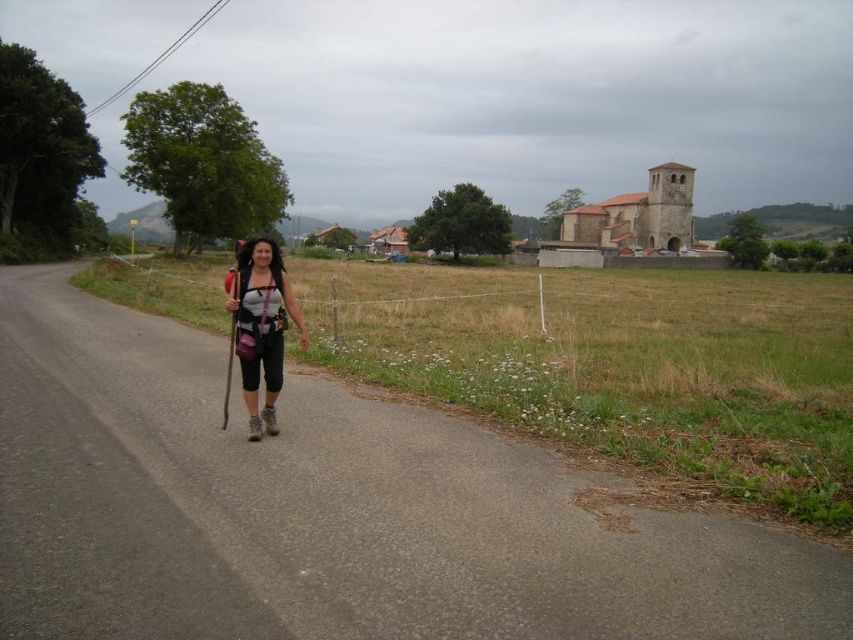
You are a hiker who wants to place your wooden ski pole at center on the ground next to the gray asphalt road at center. According to the scene, where should you place it relative to the road?

The gray asphalt road at center is positioned on the right side of the wooden ski pole at center, so you should place the wooden ski pole at center to the left of the gray asphalt road at center.

You are a hiker who wants to know if the gray asphalt road at center is higher or lower than the matte black backpack at center. Based on the scene, can you determine which one is taller?

The gray asphalt road at center has a lesser height compared to matte black backpack at center, so the matte black backpack at center is taller.

You are a traveler carrying a matte black backpack at center and a wooden ski pole at center. You need to pack both items into a storage compartment that can only hold one item at a time. Which item should you choose to store first if you want to maximize the remaining space for other items?

The matte black backpack at center is smaller than the wooden ski pole at center, so storing the wooden ski pole at center first will leave more space for the smaller backpack later.